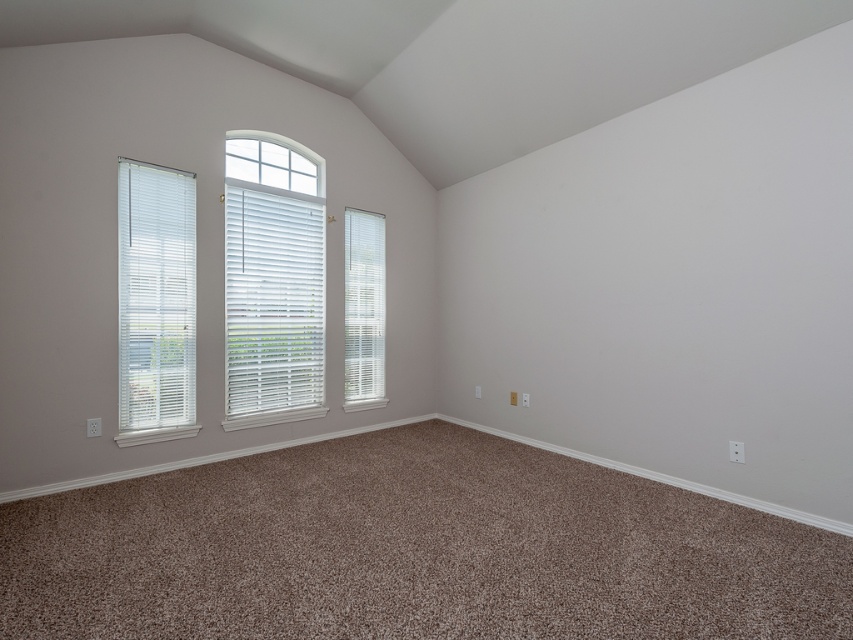
Question: Is white plastic blinds at left to the left of white/smooth blinds at center from the viewer's perspective?

Choices:
 (A) no
 (B) yes

Answer: (B)

Question: Which point is farther from the camera taking this photo?

Choices:
 (A) (364, 273)
 (B) (279, 230)

Answer: (A)

Question: Which of the following is the farthest from the observer?

Choices:
 (A) (235, 360)
 (B) (347, 385)

Answer: (B)

Question: Is white wood blinds at center in front of white/smooth blinds at center?

Choices:
 (A) no
 (B) yes

Answer: (B)

Question: Which of the following is the closest to the observer?

Choices:
 (A) white/smooth blinds at center
 (B) white wood blinds at center
 (C) white plastic blinds at left

Answer: (C)

Question: Is white wood blinds at center smaller than white/smooth blinds at center?

Choices:
 (A) no
 (B) yes

Answer: (A)